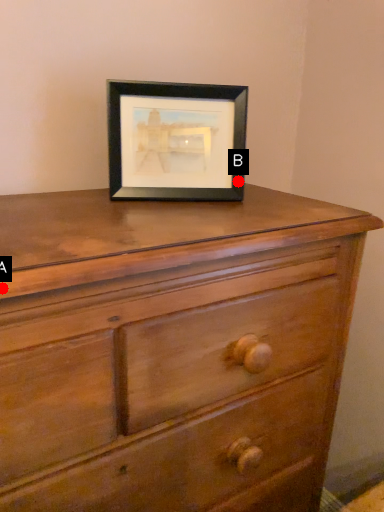
Question: Two points are circled on the image, labeled by A and B beside each circle. Which point is farther from the camera taking this photo?

Choices:
 (A) A is further
 (B) B is further

Answer: (B)